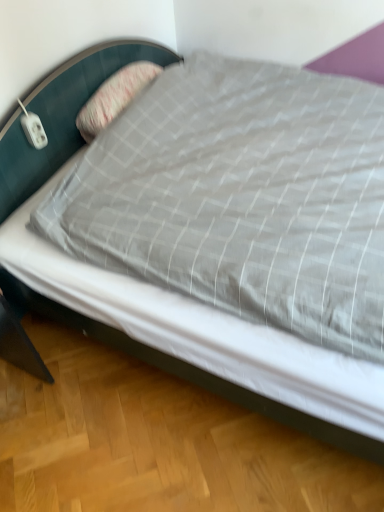
At what (x,y) coordinates should I click in order to perform the action: click on pink textured pillow at upper left. Please return your answer as a coordinate pair (x, y). Looking at the image, I should click on (114, 97).

The image size is (384, 512). Describe the element at coordinates (114, 97) in the screenshot. I see `pink textured pillow at upper left` at that location.

Locate an element on the screen. This screenshot has width=384, height=512. pink textured pillow at upper left is located at coordinates (114, 97).